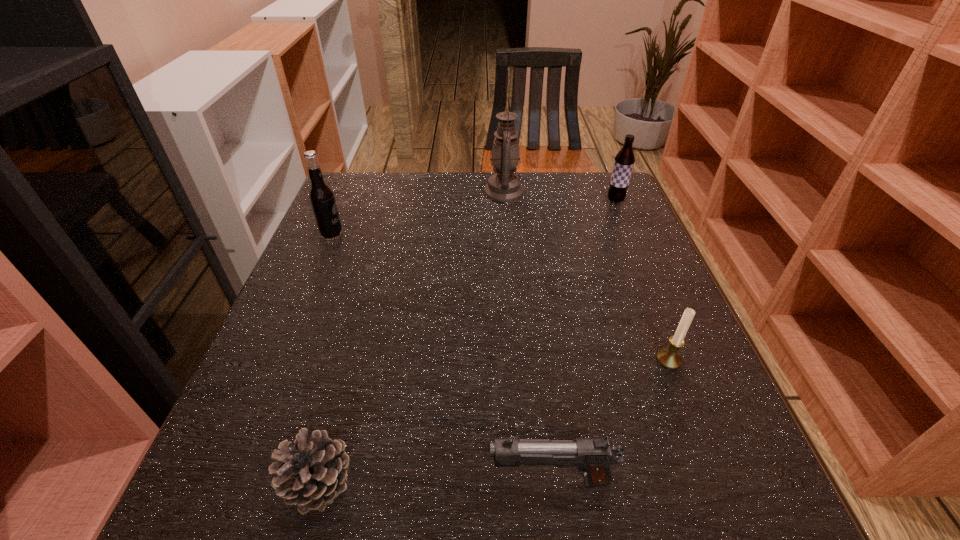
Where is `root beer that is at the left edge`? The width and height of the screenshot is (960, 540). root beer that is at the left edge is located at coordinates (321, 196).

At what (x,y) coordinates should I click in order to perform the action: click on pinecone that is at the left edge. Please return your answer as a coordinate pair (x, y). The image size is (960, 540). Looking at the image, I should click on pyautogui.click(x=311, y=473).

In order to click on root beer that is at the right edge in this screenshot , I will do `click(624, 161)`.

Find the location of `candle holder that is at the right edge`. candle holder that is at the right edge is located at coordinates (669, 358).

What are the coordinates of `object that is at the near left corner` in the screenshot? It's located at (311, 473).

The image size is (960, 540). Identify the location of object present at the far right corner. (624, 161).

Locate an element on the screen. vacant region at the far edge is located at coordinates (398, 176).

This screenshot has width=960, height=540. I want to click on vacant space at the near edge of the desktop, so pyautogui.click(x=472, y=488).

In the image, there is a desktop. At what (x,y) coordinates should I click in order to perform the action: click on free region at the left edge. Please return your answer as a coordinate pair (x, y). Looking at the image, I should click on (340, 293).

In the image, there is a desktop. Identify the location of vacant area at the right edge. Image resolution: width=960 pixels, height=540 pixels. (603, 220).